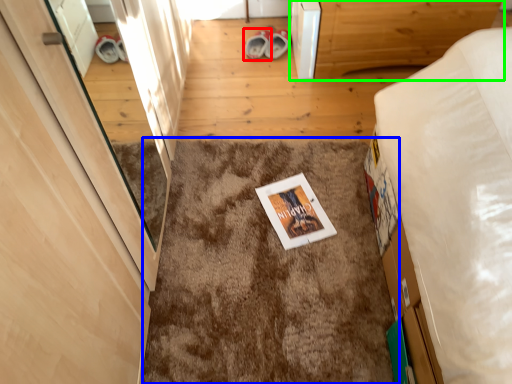
Question: Which object is positioned farthest from footwear (highlighted by a red box)? Select from mat (highlighted by a blue box) and furniture (highlighted by a green box).

Choices:
 (A) mat
 (B) furniture

Answer: (A)